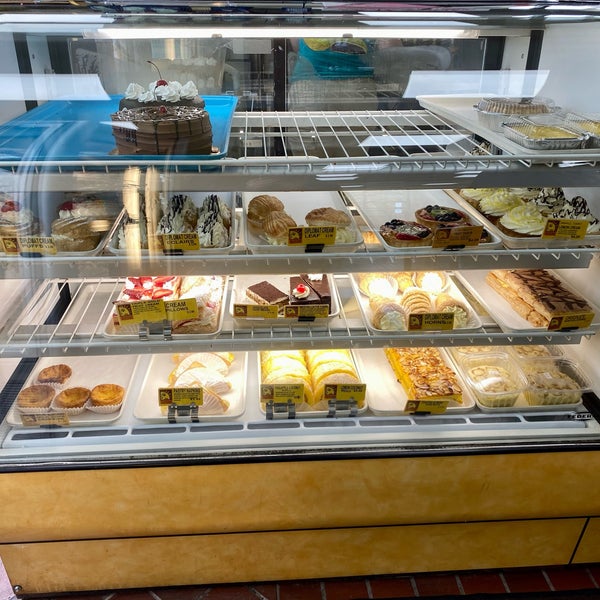
I want to click on blue tray, so click(x=67, y=139).